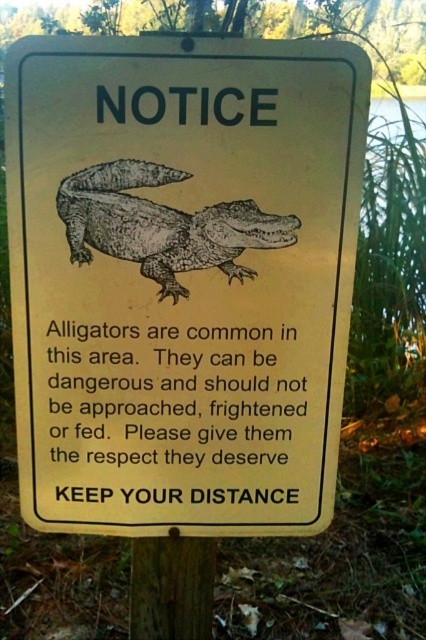
Question: Which of the following is the farthest from the observer?

Choices:
 (A) (85, 364)
 (B) (190, 540)
 (C) (103, 180)

Answer: (B)

Question: Estimate the real-world distances between objects in this image. Which object is closer to the brown textured alligator at center?

Choices:
 (A) brown wood pole at center
 (B) yellow paper sign at center

Answer: (B)

Question: Does yellow paper sign at center appear under brown wood pole at center?

Choices:
 (A) yes
 (B) no

Answer: (B)

Question: Does yellow paper sign at center appear on the left side of brown textured alligator at center?

Choices:
 (A) no
 (B) yes

Answer: (A)

Question: Which point is closer to the camera?

Choices:
 (A) [184, 612]
 (B) [229, 282]
 (C) [186, 54]

Answer: (C)

Question: Considering the relative positions of yellow paper sign at center and brown textured alligator at center in the image provided, where is yellow paper sign at center located with respect to brown textured alligator at center?

Choices:
 (A) below
 (B) above

Answer: (A)